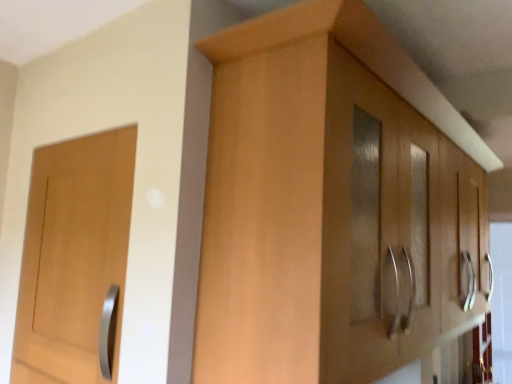
Where is `matte wood door at left`? matte wood door at left is located at coordinates click(74, 259).

Describe the element at coordinates (74, 259) in the screenshot. I see `matte wood door at left` at that location.

Looking at this image, in order to face light wood cabinet at center, should I rotate leftwards or rightwards?

You should rotate right by 21.068 degrees.

What do you see at coordinates (326, 204) in the screenshot? I see `light wood cabinet at center` at bounding box center [326, 204].

Identify the location of light wood cabinet at center. This screenshot has height=384, width=512. (326, 204).

Identify the location of matte wood door at left. (74, 259).

Consider the image. Between light wood cabinet at center and matte wood door at left, which one appears on the left side from the viewer's perspective?

From the viewer's perspective, matte wood door at left appears more on the left side.

Considering the positions of objects light wood cabinet at center and matte wood door at left in the image provided, who is in front, light wood cabinet at center or matte wood door at left?

light wood cabinet at center is in front.

Is point (373, 113) more distant than point (57, 197)?

No, (373, 113) is closer to viewer.

From the image's perspective, is light wood cabinet at center above matte wood door at left?

Yes, from the image's perspective, light wood cabinet at center is on top of matte wood door at left.

From a real-world perspective, is light wood cabinet at center positioned above or below matte wood door at left?

light wood cabinet at center is situated higher than matte wood door at left in the real world.

Consider the image. Which of these two, light wood cabinet at center or matte wood door at left, is wider?

light wood cabinet at center.

In terms of height, does light wood cabinet at center look taller or shorter compared to matte wood door at left?

light wood cabinet at center is taller than matte wood door at left.

Who is smaller, light wood cabinet at center or matte wood door at left?

matte wood door at left is smaller.

Would you say light wood cabinet at center is inside or outside matte wood door at left?

The correct answer is: outside.

Are light wood cabinet at center and matte wood door at left beside each other?

No, light wood cabinet at center is not making contact with matte wood door at left.

Is light wood cabinet at center aimed at matte wood door at left?

No, light wood cabinet at center is not oriented towards matte wood door at left.

Measure the distance from light wood cabinet at center to matte wood door at left.

The distance of light wood cabinet at center from matte wood door at left is 21.88 inches.

The height and width of the screenshot is (384, 512). I want to click on cabinetry above the matte wood door at left (from the image's perspective), so click(x=326, y=204).

Is matte wood door at left at the left side of light wood cabinet at center?

Indeed, matte wood door at left is positioned on the left side of light wood cabinet at center.

Which is in front, matte wood door at left or light wood cabinet at center?

Positioned in front is light wood cabinet at center.

Is point (112, 272) closer to viewer compared to point (233, 198)?

No, it is behind (233, 198).

From the image's perspective, which is above, matte wood door at left or light wood cabinet at center?

From the image's view, light wood cabinet at center is above.

From a real-world perspective, is matte wood door at left located higher than light wood cabinet at center?

Actually, matte wood door at left is physically below light wood cabinet at center in the real world.

Considering the relative sizes of matte wood door at left and light wood cabinet at center in the image provided, is matte wood door at left wider than light wood cabinet at center?

Incorrect, the width of matte wood door at left does not surpass that of light wood cabinet at center.

Does matte wood door at left have a greater height compared to light wood cabinet at center?

No, matte wood door at left is not taller than light wood cabinet at center.

Considering the sizes of objects matte wood door at left and light wood cabinet at center in the image provided, who is smaller, matte wood door at left or light wood cabinet at center?

Smaller between the two is matte wood door at left.

Can we say matte wood door at left lies outside light wood cabinet at center?

Indeed, matte wood door at left is completely outside light wood cabinet at center.

Is matte wood door at left not near light wood cabinet at center?

Actually, matte wood door at left and light wood cabinet at center are a little close together.

Is matte wood door at left looking in the opposite direction of light wood cabinet at center?

Absolutely, matte wood door at left is directed away from light wood cabinet at center.

Can you tell me how much matte wood door at left and light wood cabinet at center differ in facing direction?

matte wood door at left and light wood cabinet at center are facing 91.9 degrees away from each other.

Locate an element on the screen. door below the light wood cabinet at center (from the image's perspective) is located at coordinates (74, 259).

The height and width of the screenshot is (384, 512). I want to click on cabinetry on the right of matte wood door at left, so click(326, 204).

The width and height of the screenshot is (512, 384). In order to click on door that is under the light wood cabinet at center (from a real-world perspective) in this screenshot , I will do `click(74, 259)`.